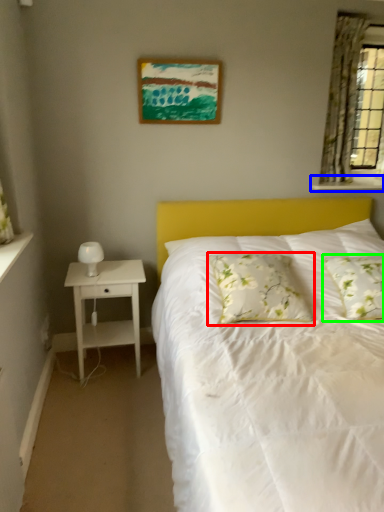
Question: Which object is the farthest from pillow (highlighted by a red box)? Choose among these: window sill (highlighted by a blue box) or pillow (highlighted by a green box).

Choices:
 (A) window sill
 (B) pillow

Answer: (A)